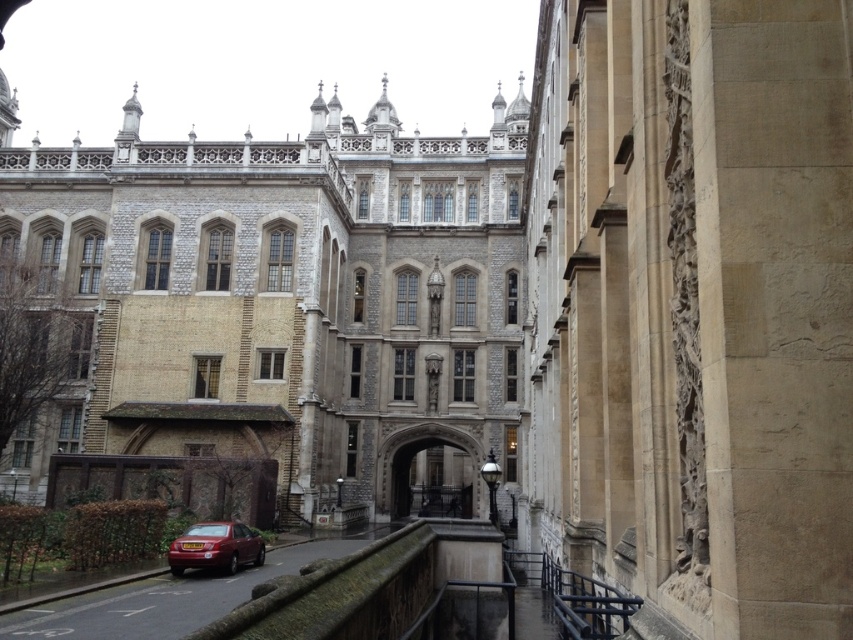
Question: In this image, where is metallic car at lower left located relative to shiny red sedan at lower center?

Choices:
 (A) left
 (B) right

Answer: (B)

Question: Among these points, which one is nearest to the camera?

Choices:
 (A) (181, 556)
 (B) (405, 492)
 (C) (355, 545)

Answer: (A)

Question: Which of the following is the farthest from the observer?

Choices:
 (A) metallic car at lower left
 (B) shiny red sedan at lower center
 (C) stone archway at center

Answer: (C)

Question: Is metallic car at lower left below stone archway at center?

Choices:
 (A) no
 (B) yes

Answer: (B)

Question: Does shiny red sedan at lower center appear over stone archway at center?

Choices:
 (A) yes
 (B) no

Answer: (A)

Question: Which point is closer to the camera?

Choices:
 (A) metallic car at lower left
 (B) shiny red sedan at lower center
 (C) stone archway at center

Answer: (A)